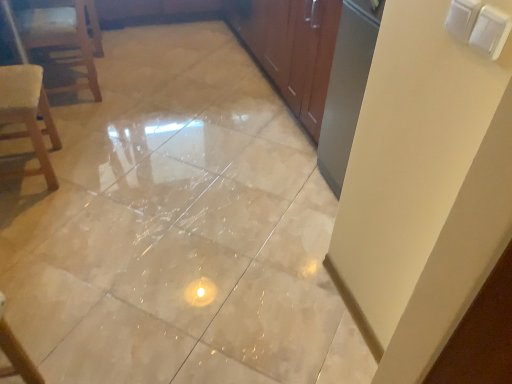
Question: Is wooden chair at left taller than beige glossy tile at center?

Choices:
 (A) no
 (B) yes

Answer: (B)

Question: From a real-world perspective, does wooden chair at left sit lower than beige glossy tile at center?

Choices:
 (A) yes
 (B) no

Answer: (B)

Question: Is wooden chair at left closer to camera compared to beige glossy tile at center?

Choices:
 (A) no
 (B) yes

Answer: (A)

Question: From the image's perspective, is wooden chair at left on top of beige glossy tile at center?

Choices:
 (A) yes
 (B) no

Answer: (A)

Question: From the image's perspective, is wooden chair at left beneath beige glossy tile at center?

Choices:
 (A) no
 (B) yes

Answer: (A)

Question: From the image's perspective, relative to wooden chair at left, is beige glossy tile at center above or below?

Choices:
 (A) above
 (B) below

Answer: (B)

Question: In terms of width, does beige glossy tile at center look wider or thinner when compared to wooden chair at left?

Choices:
 (A) wide
 (B) thin

Answer: (A)

Question: Is point (104, 145) positioned closer to the camera than point (93, 24)?

Choices:
 (A) farther
 (B) closer

Answer: (B)

Question: Relative to wooden chair at left, is beige glossy tile at center in front or behind?

Choices:
 (A) behind
 (B) front

Answer: (B)

Question: Considering the positions of wooden chair at left and beige glossy tile at center in the image, is wooden chair at left bigger or smaller than beige glossy tile at center?

Choices:
 (A) big
 (B) small

Answer: (B)

Question: Considering their positions, is wooden chair at left located in front of or behind beige glossy tile at center?

Choices:
 (A) front
 (B) behind

Answer: (B)

Question: Visually, is wooden chair at left positioned to the left or to the right of beige glossy tile at center?

Choices:
 (A) left
 (B) right

Answer: (A)

Question: Is wooden chair at left spatially inside beige glossy tile at center, or outside of it?

Choices:
 (A) inside
 (B) outside

Answer: (B)

Question: Is point (82, 23) positioned closer to the camera than point (6, 77)?

Choices:
 (A) farther
 (B) closer

Answer: (A)

Question: In terms of width, does wooden chair at left look wider or thinner when compared to wooden textured chair at left?

Choices:
 (A) thin
 (B) wide

Answer: (B)